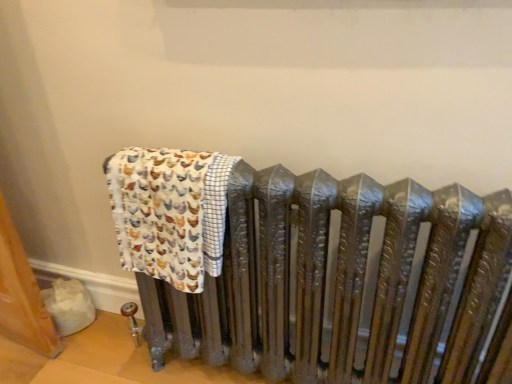
This screenshot has height=384, width=512. Find the location of `patterned fabric towel at center`. patterned fabric towel at center is located at coordinates (170, 212).

What do you see at coordinates (170, 212) in the screenshot? I see `patterned fabric towel at center` at bounding box center [170, 212].

From the picture: In order to face patterned fabric towel at center, should I rotate leftwards or rightwards?

A 10.752 degree turn to the left will do.

Identify the location of patterned fabric towel at center. (170, 212).